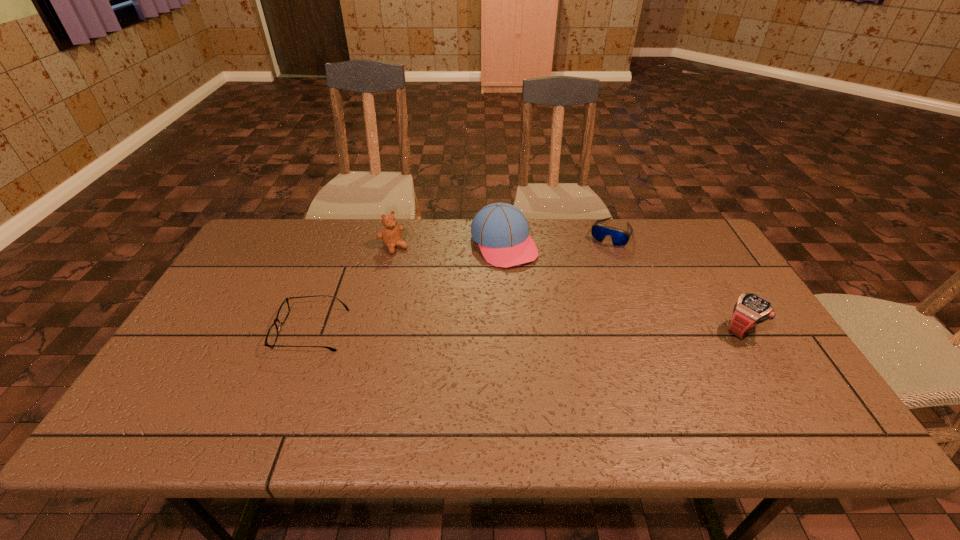
This screenshot has height=540, width=960. Find the location of `spectacles`. spectacles is located at coordinates (283, 312).

The image size is (960, 540). In order to click on the leftmost object in this screenshot , I will do `click(283, 312)`.

At what (x,y) coordinates should I click in order to perform the action: click on the third tallest object. Please return your answer as a coordinate pair (x, y). Looking at the image, I should click on (750, 309).

You are a GUI agent. You are given a task and a screenshot of the screen. Output one action in this format:
    pyautogui.click(x=<x>, y=<y>)
    Task: Click on the watch
    Image resolution: width=960 pixels, height=540 pixels.
    Given the screenshot: What is the action you would take?
    pyautogui.click(x=750, y=309)

Find the location of a particular element. The image size is (960, 540). the second object from left to right is located at coordinates (391, 236).

Locate an element on the screen. This screenshot has height=540, width=960. baseball cap is located at coordinates (501, 230).

The width and height of the screenshot is (960, 540). I want to click on sunglasses, so click(619, 237).

The height and width of the screenshot is (540, 960). Identify the location of the fourth tallest object. (619, 237).

You are a GUI agent. You are given a task and a screenshot of the screen. Output one action in this format:
    pyautogui.click(x=<x>, y=<y>)
    Task: Click on the vacant area situated on the front-facing side of the shortest object
    The width and height of the screenshot is (960, 540).
    Given the screenshot: What is the action you would take?
    pyautogui.click(x=240, y=330)

Identify the location of vacant area situated on the front-facing side of the shortest object. (248, 330).